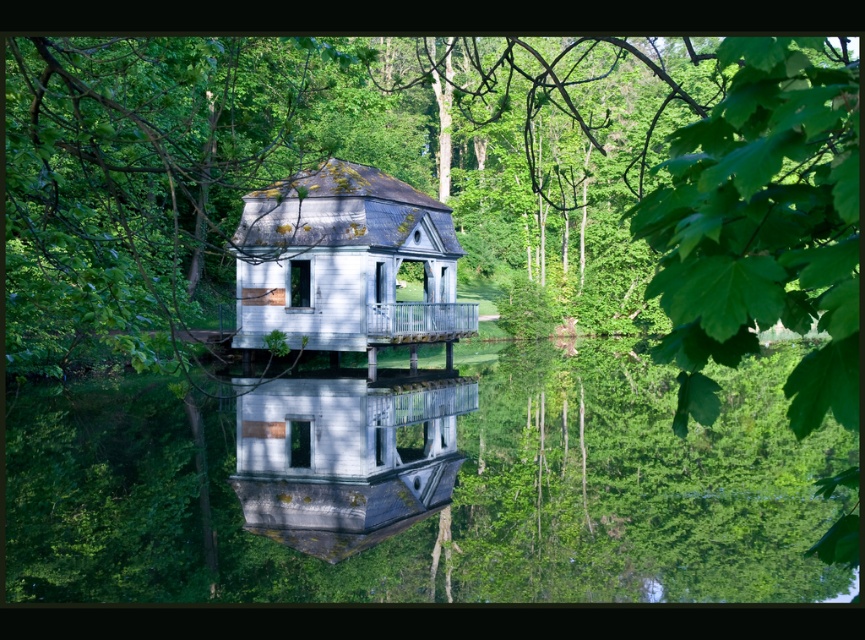
Question: Can you confirm if transparent water at center is positioned to the right of white matte house at center?

Choices:
 (A) yes
 (B) no

Answer: (A)

Question: Which point is closer to the camera taking this photo?

Choices:
 (A) (369, 570)
 (B) (441, 396)

Answer: (A)

Question: Does transparent water at center have a smaller size compared to white matte house at center?

Choices:
 (A) no
 (B) yes

Answer: (A)

Question: Which point appears farthest from the camera in this image?

Choices:
 (A) (338, 488)
 (B) (75, 416)

Answer: (B)

Question: Does transparent water at center have a greater width compared to white matte house at center?

Choices:
 (A) no
 (B) yes

Answer: (B)

Question: Which of the following is the farthest from the observer?

Choices:
 (A) (370, 436)
 (B) (316, 474)

Answer: (A)